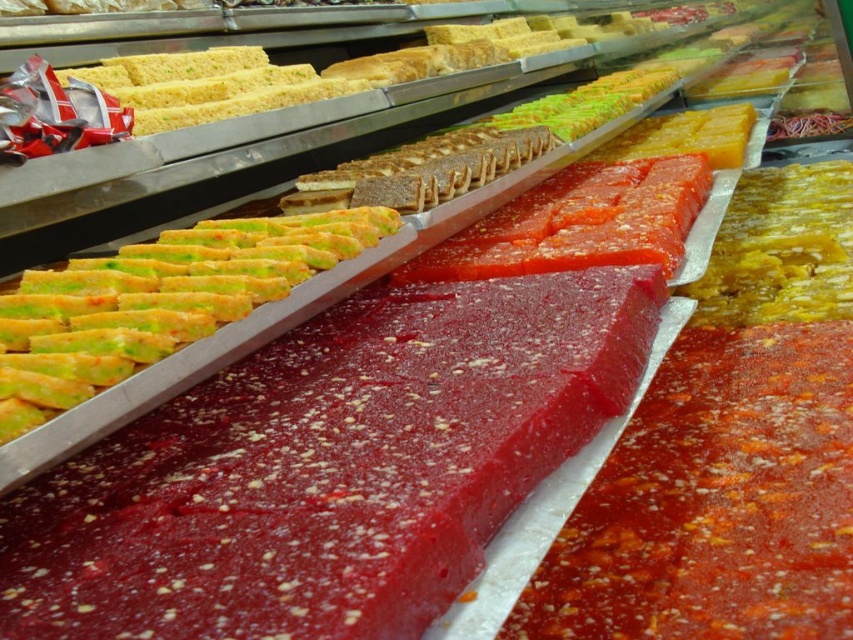
Question: Does red speckled gelatinous at center appear on the left side of yellow glossy candy at right?

Choices:
 (A) yes
 (B) no

Answer: (A)

Question: Can you confirm if red speckled gelatinous at center is positioned to the left of semi-translucent red jelly at center?

Choices:
 (A) no
 (B) yes

Answer: (A)

Question: Which point is closer to the camera?

Choices:
 (A) (772, 256)
 (B) (828, 481)
 (C) (511, 163)
 (D) (97, 576)

Answer: (D)

Question: Is yellow glossy candy at right further to camera compared to green textured cake at center?

Choices:
 (A) no
 (B) yes

Answer: (A)

Question: Which object is the closest to the green textured pastry at upper left?

Choices:
 (A) yellow glossy candy at right
 (B) semi-translucent red jelly at center
 (C) red glossy candy at center
 (D) yellow matte rectangular block at upper right

Answer: (C)

Question: Estimate the real-world distances between objects in this image. Which object is farther from the semi-translucent red jelly at center?

Choices:
 (A) red speckled gelatinous at center
 (B) green textured pastry at upper left
 (C) red glossy candy at center
 (D) yellow matte rectangular block at upper right

Answer: (B)